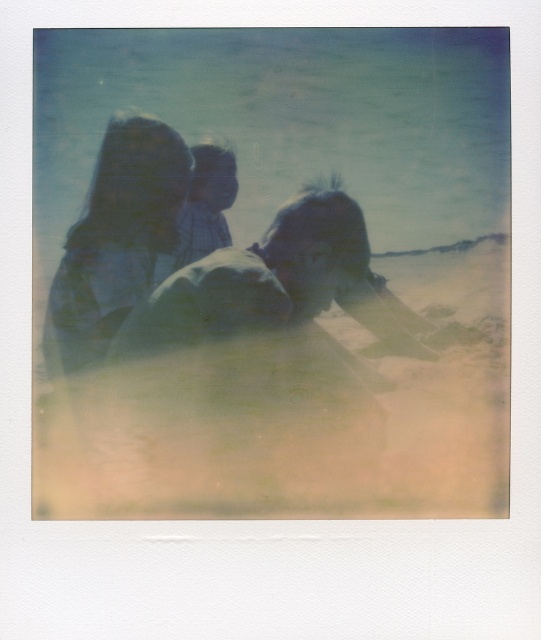
Between blue fabric couple at center and plaid fabric shirt at center, which one has less height?

plaid fabric shirt at center

Is blue fabric couple at center wider than plaid fabric shirt at center?

Indeed, blue fabric couple at center has a greater width compared to plaid fabric shirt at center.

Locate an element on the screen. This screenshot has width=541, height=640. blue fabric couple at center is located at coordinates pos(203,253).

The height and width of the screenshot is (640, 541). What are the coordinates of `blue fabric couple at center` in the screenshot? It's located at (203, 253).

Can you confirm if blue fabric couple at center is bigger than translucent blue hair at upper left?

Yes.

Between blue fabric couple at center and translucent blue hair at upper left, which one has more height?

With more height is translucent blue hair at upper left.

Does point (82, 330) lie behind point (72, 304)?

That is False.

Where is `blue fabric couple at center`? Image resolution: width=541 pixels, height=640 pixels. blue fabric couple at center is located at coordinates (203, 253).

Between translucent blue hair at upper left and plaid fabric shirt at center, which one has less height?

plaid fabric shirt at center

Does translucent blue hair at upper left appear on the right side of plaid fabric shirt at center?

In fact, translucent blue hair at upper left is to the left of plaid fabric shirt at center.

Describe the element at coordinates (116, 240) in the screenshot. I see `translucent blue hair at upper left` at that location.

Where is `translucent blue hair at upper left`? translucent blue hair at upper left is located at coordinates (116, 240).